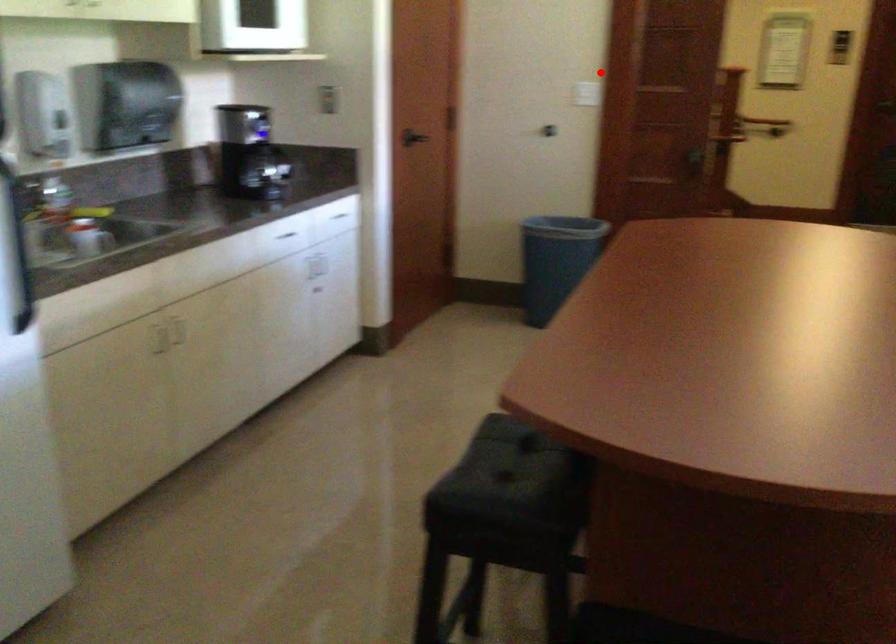
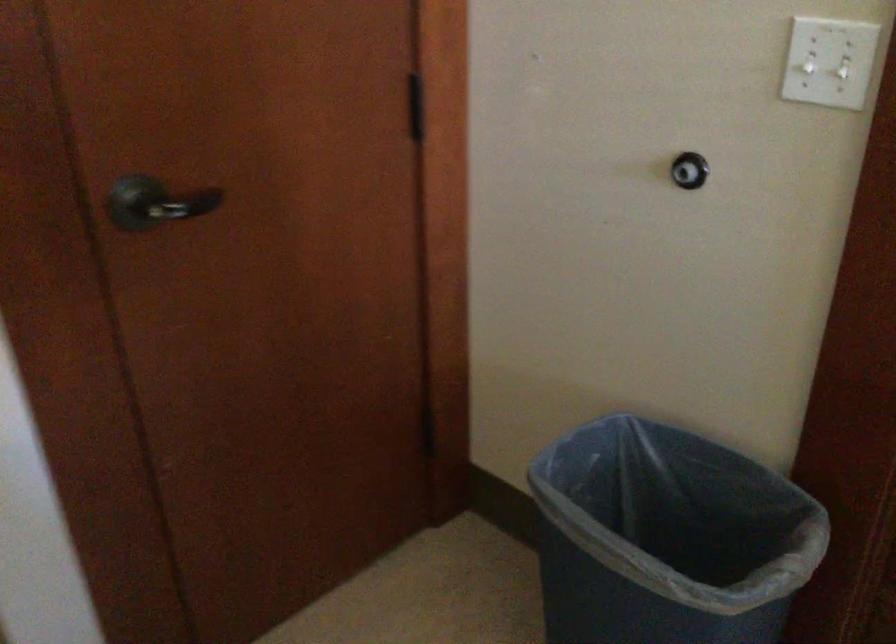
Where in the second image is the point corresponding to the highlighted location from the first image?

(807, 67)